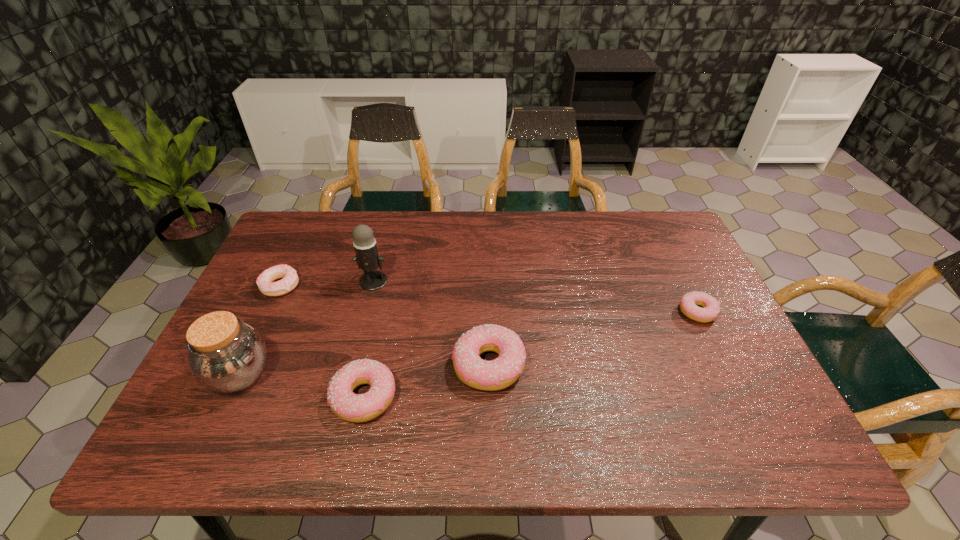
Where is `vacant point at the left edge`? vacant point at the left edge is located at coordinates (242, 319).

You are a GUI agent. You are given a task and a screenshot of the screen. Output one action in this format:
    pyautogui.click(x=<x>, y=<y>)
    Task: Click on the vacant space at the right edge
    
    Given the screenshot: What is the action you would take?
    pyautogui.click(x=724, y=320)

In the image, there is a desktop. Identify the location of vacant space at the far left corner. The width and height of the screenshot is (960, 540). (335, 213).

What are the coordinates of `free location at the far right corner of the desktop` in the screenshot? It's located at (650, 253).

At what (x,y) coordinates should I click in order to perform the action: click on unoccupied area between the rightmost doughnut and the second object from right to left. Please return your answer as a coordinate pair (x, y). This screenshot has width=960, height=540. Looking at the image, I should click on (592, 339).

Where is `blank region between the rightmost object and the leftmost doughnut`? blank region between the rightmost object and the leftmost doughnut is located at coordinates 489,299.

Where is `free area in between the fourth tallest object and the rightmost doughnut`? free area in between the fourth tallest object and the rightmost doughnut is located at coordinates (531, 354).

Locate an element on the screen. vacant space that's between the second doughnut from right to left and the leftmost doughnut is located at coordinates (384, 326).

You are a GUI agent. You are given a task and a screenshot of the screen. Output one action in this format:
    pyautogui.click(x=<x>, y=<y>)
    Task: Click on the vacant area that lies between the second tallest doughnut and the microphone
    This screenshot has height=540, width=960.
    Given the screenshot: What is the action you would take?
    pyautogui.click(x=370, y=339)

This screenshot has height=540, width=960. Identify the location of free space that is in between the fifth shortest object and the leftmost doughnut. (260, 330).